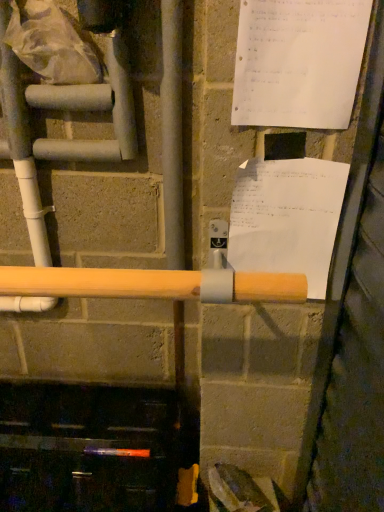
Question: Does white plastic water pipe at left have a greater width compared to white paper at upper right, acting as the 1th paper starting from the front?

Choices:
 (A) no
 (B) yes

Answer: (B)

Question: Is white plastic water pipe at left oriented away from white paper at upper right, acting as the 1th paper starting from the front?

Choices:
 (A) yes
 (B) no

Answer: (B)

Question: From the image's perspective, would you say white plastic water pipe at left is shown under white paper at upper right, acting as the 1th paper starting from the front?

Choices:
 (A) no
 (B) yes

Answer: (B)

Question: Is white plastic water pipe at left thinner than white paper at upper right, acting as the 1th paper starting from the front?

Choices:
 (A) no
 (B) yes

Answer: (A)

Question: From the image's perspective, would you say white plastic water pipe at left is positioned over white paper at upper right, which is the second paper from back to front?

Choices:
 (A) no
 (B) yes

Answer: (A)

Question: Does white plastic water pipe at left have a smaller size compared to white paper at upper right, acting as the 1th paper starting from the front?

Choices:
 (A) no
 (B) yes

Answer: (A)

Question: From a real-world perspective, is translucent plastic bag at upper left on white paper at upper right, marked as the 2th paper in a bottom-to-top arrangement?

Choices:
 (A) no
 (B) yes

Answer: (A)

Question: Considering the relative sizes of translucent plastic bag at upper left and white paper at upper right, which is the second paper from back to front, in the image provided, is translucent plastic bag at upper left taller than white paper at upper right, which is the second paper from back to front,?

Choices:
 (A) no
 (B) yes

Answer: (A)

Question: Could white paper at upper right, which is the second paper from back to front, be considered to be inside translucent plastic bag at upper left?

Choices:
 (A) no
 (B) yes

Answer: (A)

Question: From the image's perspective, is translucent plastic bag at upper left under white paper at upper right, the first paper when ordered from top to bottom?

Choices:
 (A) no
 (B) yes

Answer: (A)

Question: Is translucent plastic bag at upper left looking in the opposite direction of white paper at upper right, marked as the 2th paper in a bottom-to-top arrangement?

Choices:
 (A) no
 (B) yes

Answer: (A)

Question: Can you confirm if translucent plastic bag at upper left is positioned to the left of white paper at upper right, the first paper when ordered from top to bottom?

Choices:
 (A) no
 (B) yes

Answer: (B)

Question: Is the surface of white paper at upper right, the second paper when ordered from front to back, in direct contact with white plastic water pipe at left?

Choices:
 (A) no
 (B) yes

Answer: (A)